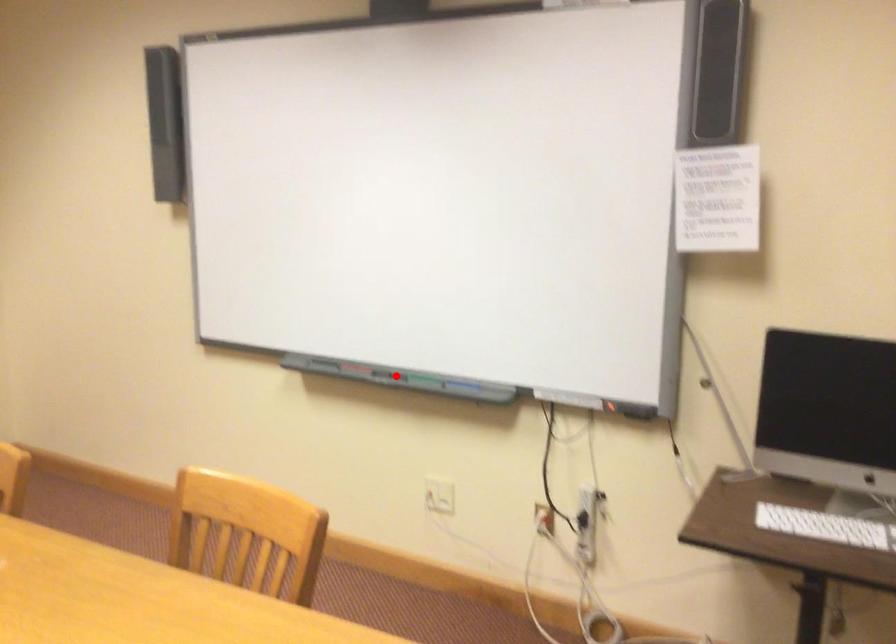
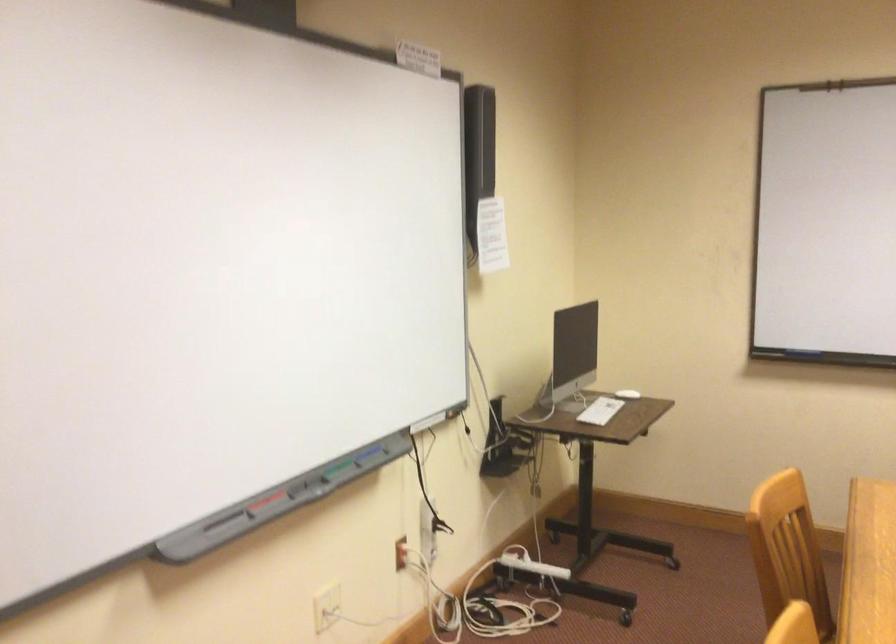
Question: I am providing you with two images of the same scene from different viewpoints. Image1 has a red point marked. In image2, the corresponding 3D location appears at what relative position? Reply with the corresponding letter.

Choices:
 (A) Closer
 (B) Farther

Answer: (A)